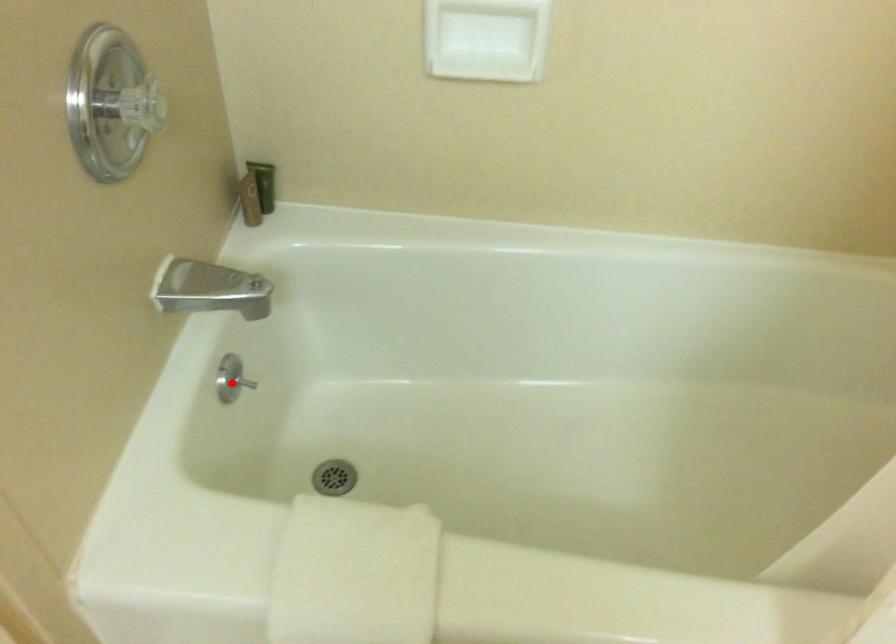
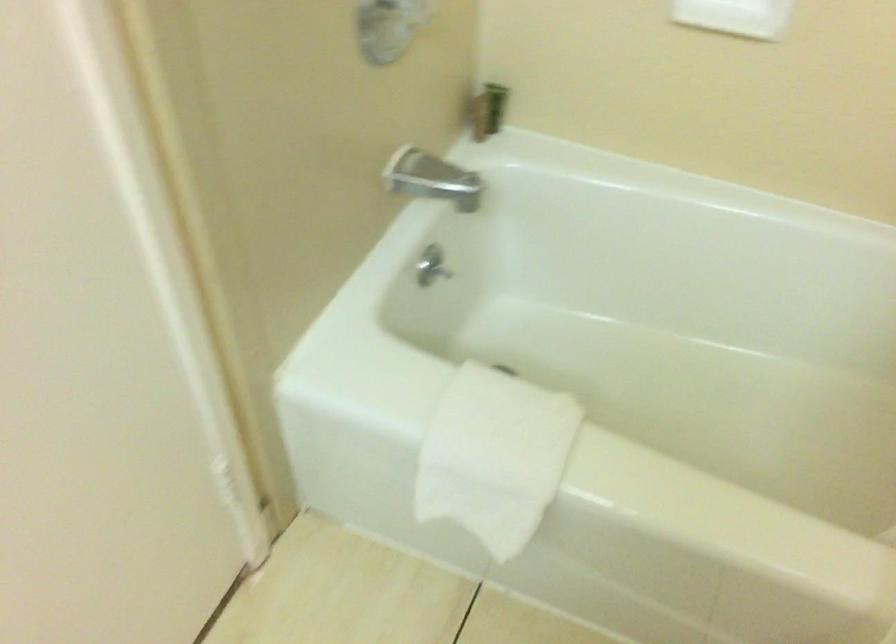
Question: I am providing you with two images of the same scene from different viewpoints. Image1 has a red point marked. In image2, the corresponding 3D location appears at what relative position? Reply with the corresponding letter.

Choices:
 (A) Closer
 (B) Farther

Answer: (B)